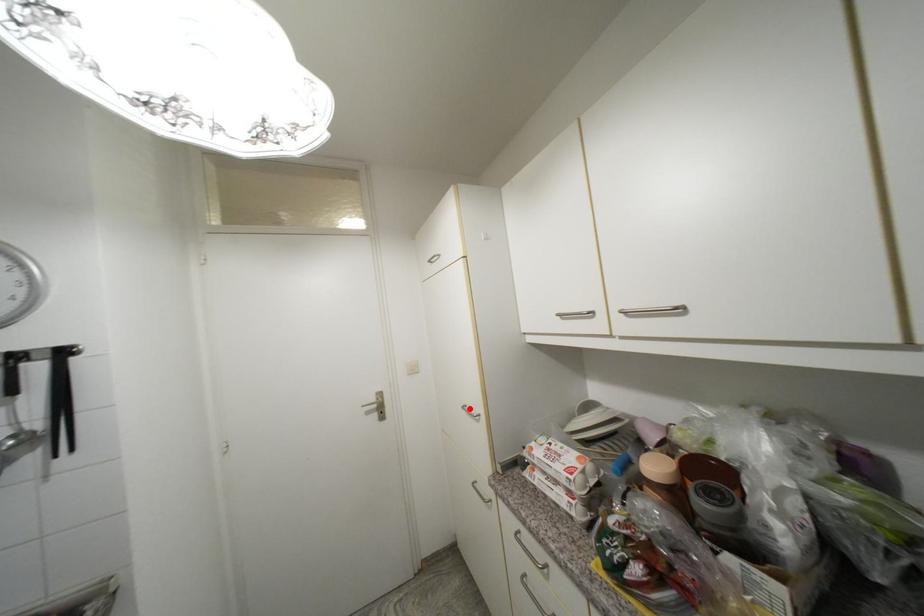
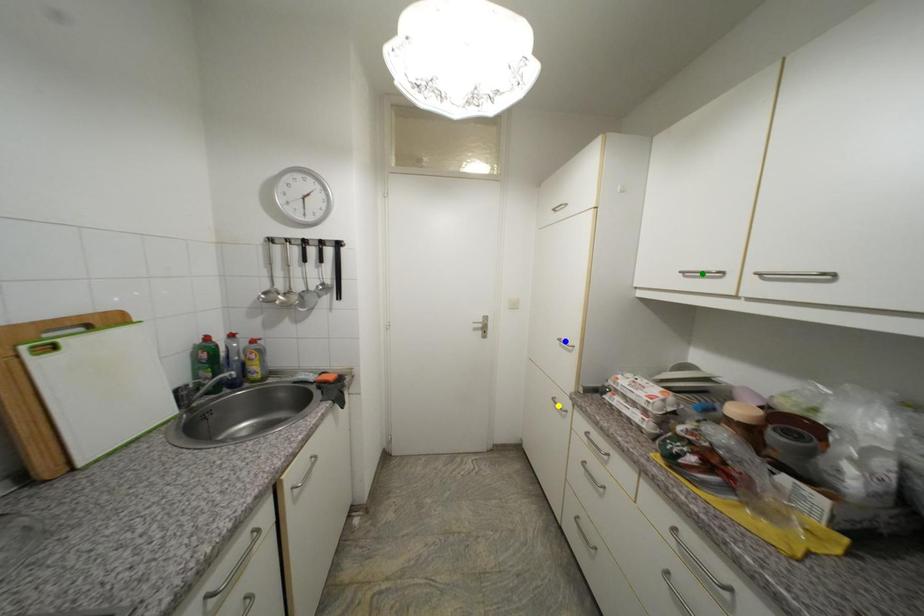
Question: I am providing you with two images of the same scene from different viewpoints. A red point is marked on the first image. You are given multiple points on the second image. Can you choose the point in image 2 that corresponds to the point in image 1?

Choices:
 (A) green point
 (B) blue point
 (C) yellow point

Answer: (B)